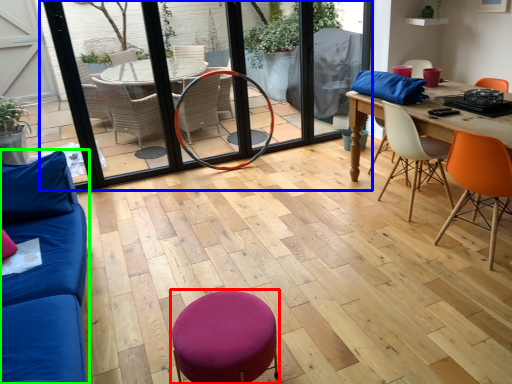
Question: Based on their relative distances, which object is nearer to bar stool (highlighted by a red box)? Choose from screen door (highlighted by a blue box) and studio couch (highlighted by a green box).

Choices:
 (A) screen door
 (B) studio couch

Answer: (B)